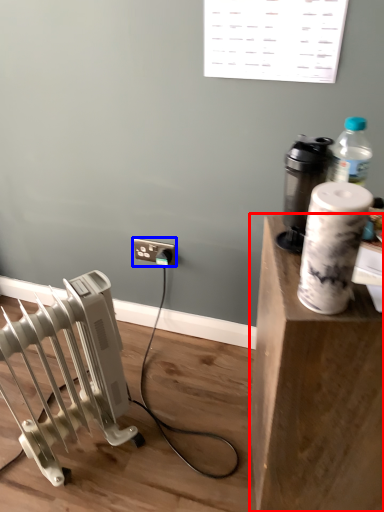
Question: Which object is closer to the camera taking this photo, furniture (highlighted by a red box) or electric outlet (highlighted by a blue box)?

Choices:
 (A) furniture
 (B) electric outlet

Answer: (A)